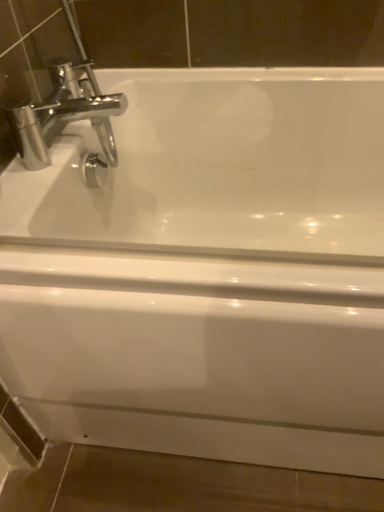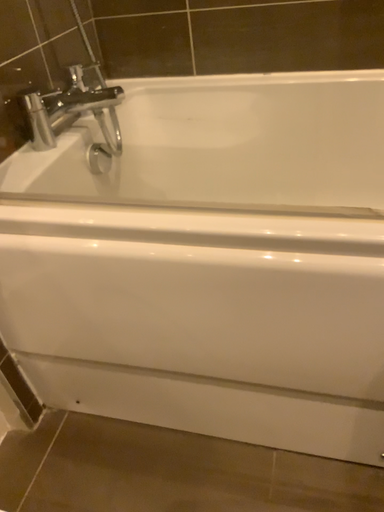
Question: How did the camera likely rotate when shooting the video?

Choices:
 (A) rotated right
 (B) rotated left

Answer: (B)